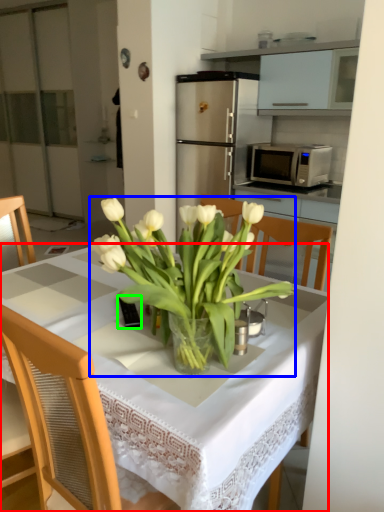
Question: Which object is the farthest from desk (highlighted by a red box)? Choose among these: flower (highlighted by a blue box) or corded phone (highlighted by a green box).

Choices:
 (A) flower
 (B) corded phone

Answer: (B)